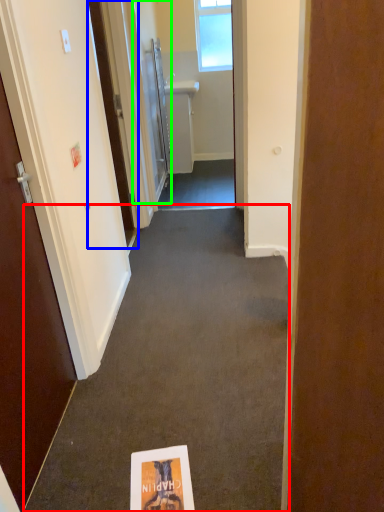
Question: Considering the real-world distances, which object is closest to path (highlighted by a red box)? door (highlighted by a blue box) or door (highlighted by a green box).

Choices:
 (A) door
 (B) door

Answer: (A)